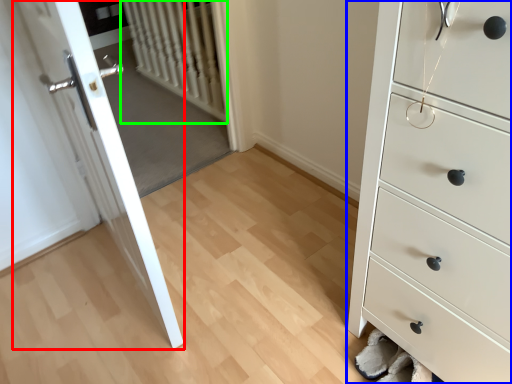
Question: Considering the real-world distances, which object is closest to door (highlighted by a red box)? chest of drawers (highlighted by a blue box) or radiator (highlighted by a green box).

Choices:
 (A) chest of drawers
 (B) radiator

Answer: (A)